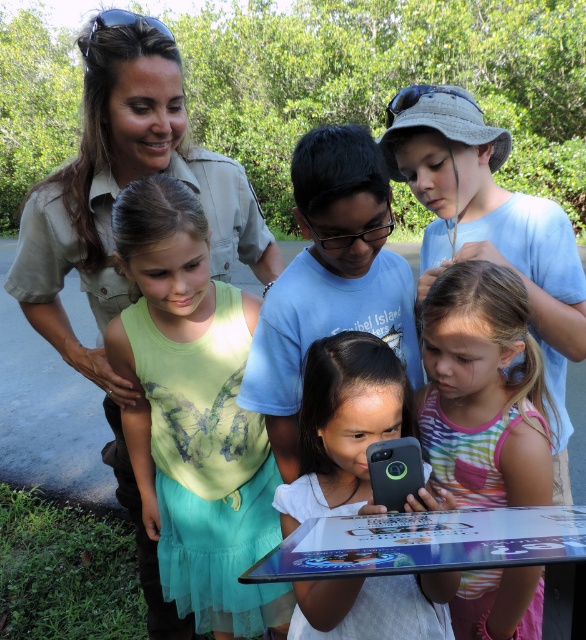
You are a photographer trying to capture a candid shot of the striped cotton tank top at center without the black matte phone at center blocking the view. Which object should you move closer to the camera to achieve this?

You should move the striped cotton tank top at center closer to the camera because the black matte phone at center is currently behind it, so bringing the tank top forward would allow it to be seen without obstruction.

You are a photographer who wants to take a picture of the striped cotton tank top at center and the camera. The minimum distance required between the camera and the subject to focus properly is 4 feet. Can you take the photo without moving either object?

The striped cotton tank top at center and camera are 4.10 feet apart from each other, so yes, the photographer can take the photo without moving either object since the distance meets the minimum requirement of 4 feet.

You are a photographer trying to capture a group photo of the matte khaki uniform at upper left and the black matte phone at center. Which object should you focus on first if you want to ensure both are in focus, considering their sizes in the frame?

The matte khaki uniform at upper left is much taller than the black matte phone at center, so focusing on the taller object first would help ensure both are in focus.